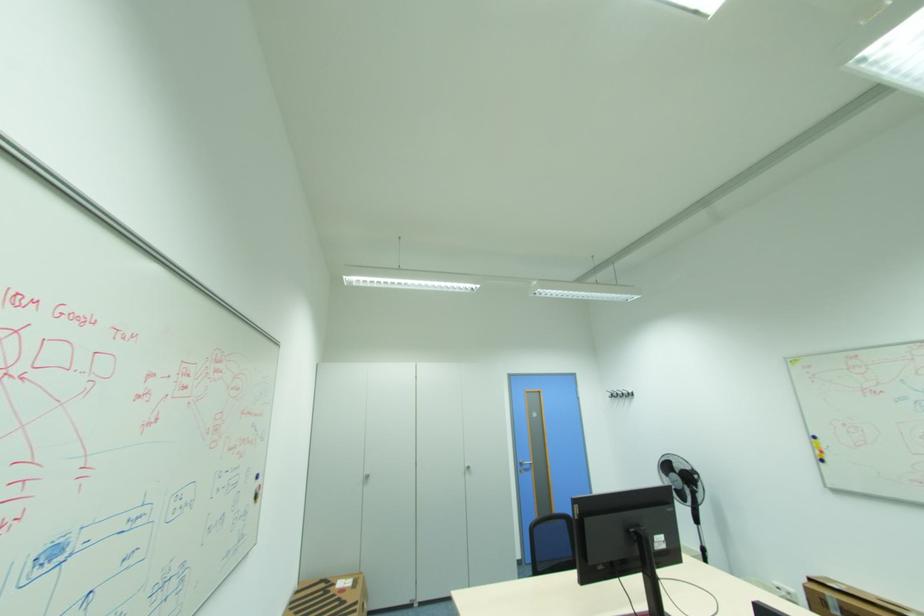
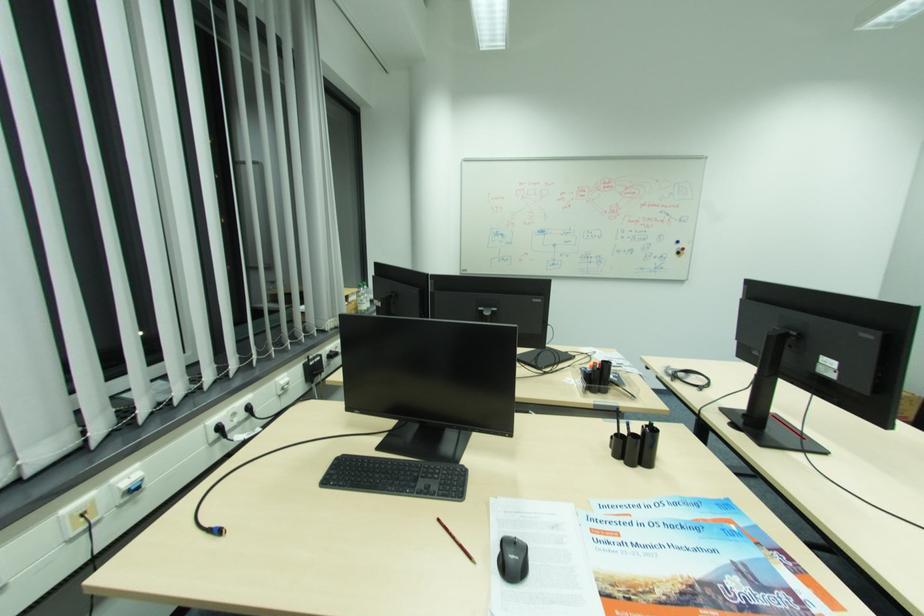
The point at (261,496) is marked in the first image. Where is the corresponding point in the second image?

(684, 253)